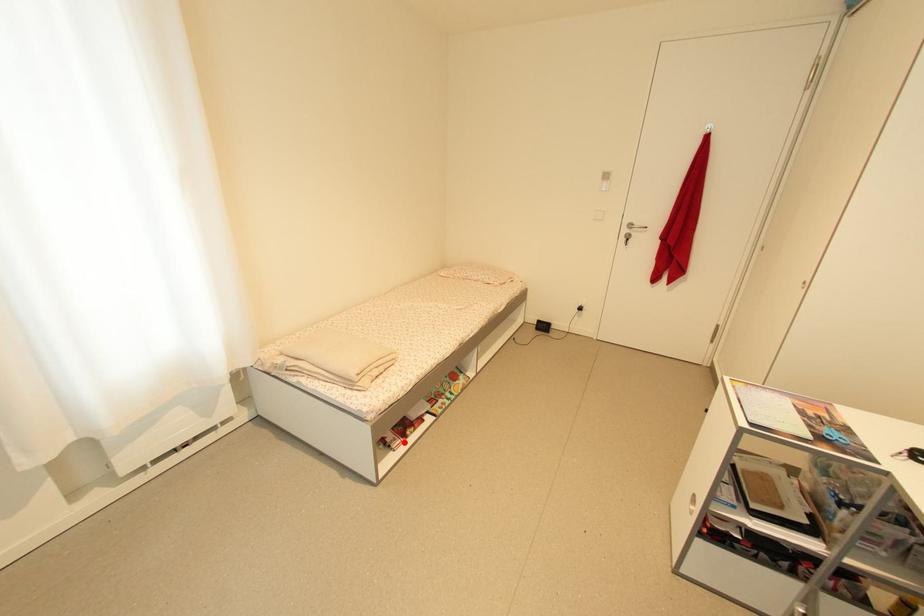
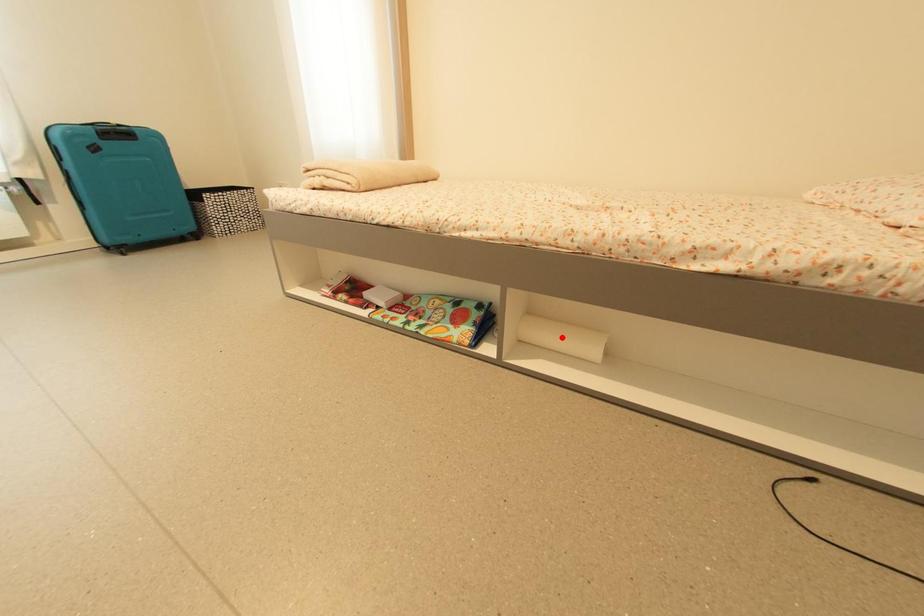
I am providing you with two images of the same scene from different viewpoints. A red point is marked on the first image and another point is marked on the second image. Do the highlighted points in image1 and image2 indicate the same real-world spot?

No